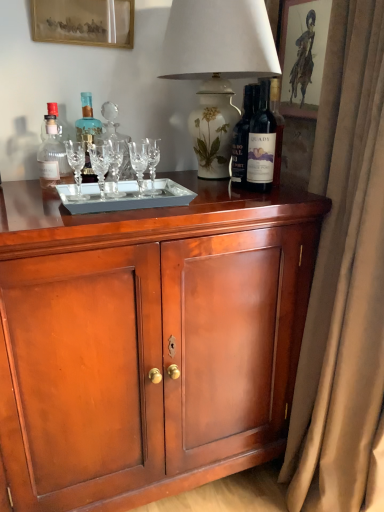
Locate an element on the screen. free space above mahogany cabinet at center (from a real-world perspective) is located at coordinates (163, 178).